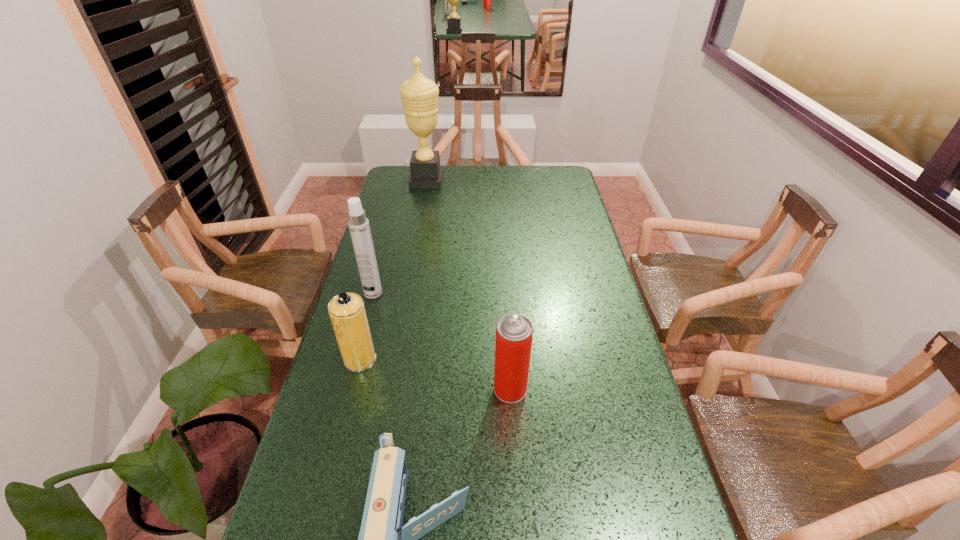
The width and height of the screenshot is (960, 540). I want to click on the tallest object, so click(x=419, y=95).

Where is `trophy cup`? This screenshot has height=540, width=960. trophy cup is located at coordinates (419, 95).

I want to click on the farthest aerosol can, so point(358,224).

The height and width of the screenshot is (540, 960). I want to click on the second farthest object, so pyautogui.click(x=358, y=224).

This screenshot has height=540, width=960. In order to click on the rightmost aerosol can in this screenshot , I will do [x=514, y=332].

In order to click on the rightmost object in this screenshot , I will do `click(514, 332)`.

This screenshot has width=960, height=540. I want to click on the second farthest aerosol can, so click(x=347, y=312).

At what (x,y) coordinates should I click in order to perform the action: click on vacant position located at the front of the trophy cup with handles. Please return your answer as a coordinate pair (x, y). This screenshot has width=960, height=540. Looking at the image, I should click on (x=493, y=180).

Locate an element on the screen. This screenshot has height=540, width=960. vacant space located 0.070m on the back of the fourth shortest object is located at coordinates (378, 274).

Where is `blank area located 0.240m on the left of the rightmost object`? The image size is (960, 540). blank area located 0.240m on the left of the rightmost object is located at coordinates (404, 389).